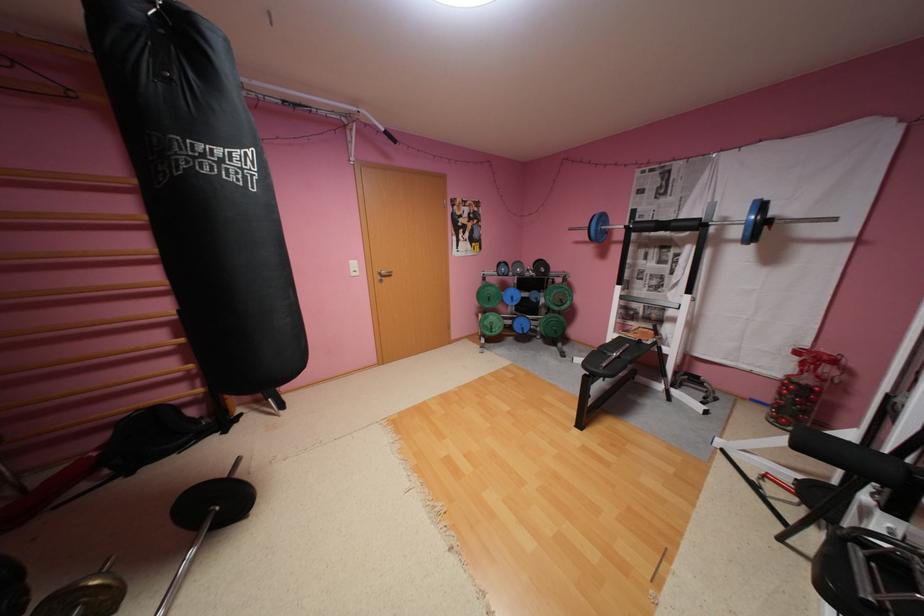
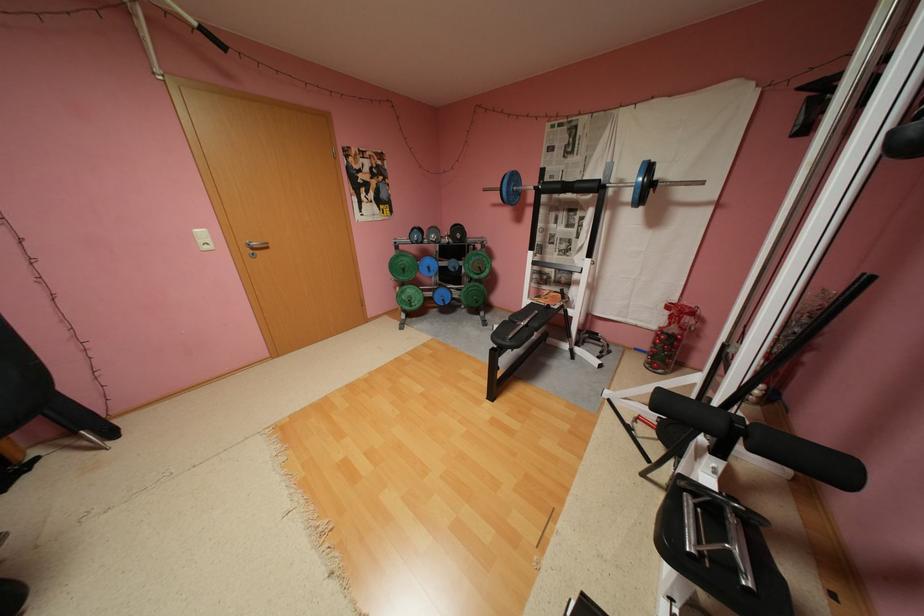
Find the pixel in the second image that matches point (501, 331) in the first image.

(419, 306)